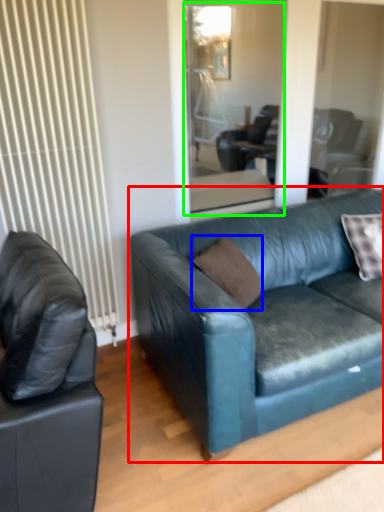
Question: Considering the real-world distances, which object is closest to studio couch (highlighted by a red box)? pillow (highlighted by a blue box) or glass door (highlighted by a green box).

Choices:
 (A) pillow
 (B) glass door

Answer: (A)